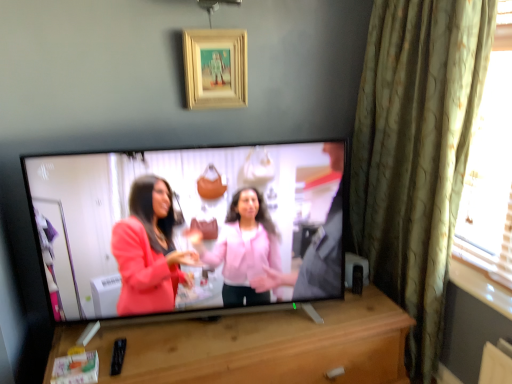
I want to click on vacant area on top of wooden cabinet at center (from a real-world perspective), so click(x=265, y=327).